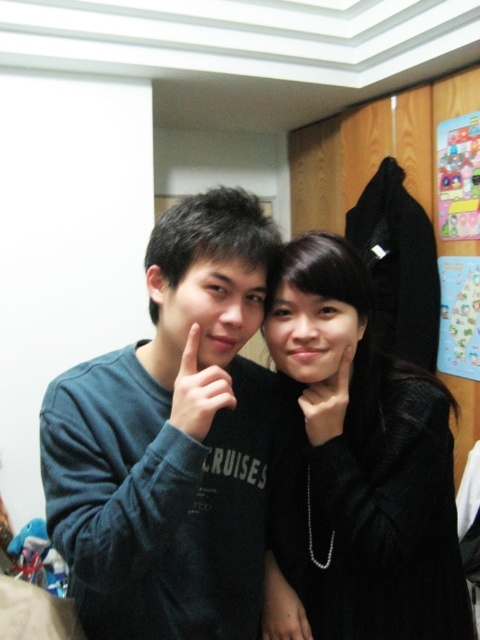
Question: Is dark blue sweatshirt at center further to the viewer compared to black matte coat at center?

Choices:
 (A) no
 (B) yes

Answer: (A)

Question: Considering the relative positions of black matte coat at center and matte black hand at center in the image provided, where is black matte coat at center located with respect to matte black hand at center?

Choices:
 (A) right
 (B) left

Answer: (A)

Question: Estimate the real-world distances between objects in this image. Which object is farther from the black matte coat at center?

Choices:
 (A) dark blue sweatshirt at center
 (B) black matte hand at center
 (C) matte black hand at center

Answer: (C)

Question: Which point is closer to the camera?

Choices:
 (A) matte black hand at center
 (B) dark blue sweatshirt at center
 (C) black matte hand at center
 (D) black matte coat at center

Answer: (B)

Question: Estimate the real-world distances between objects in this image. Which object is farther from the matte black hand at center?

Choices:
 (A) black matte hand at center
 (B) black matte coat at center

Answer: (B)

Question: Is dark blue sweatshirt at center wider than black matte coat at center?

Choices:
 (A) yes
 (B) no

Answer: (A)